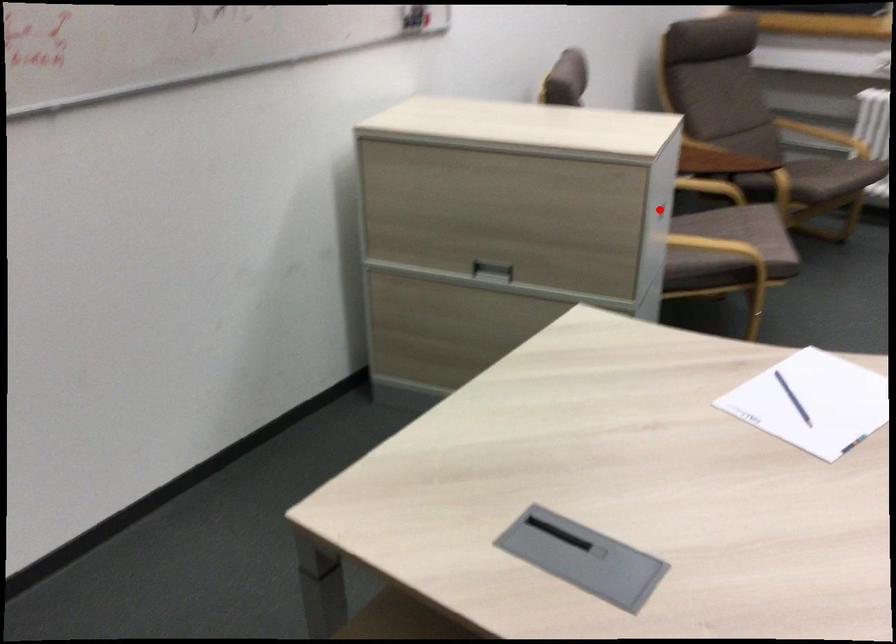
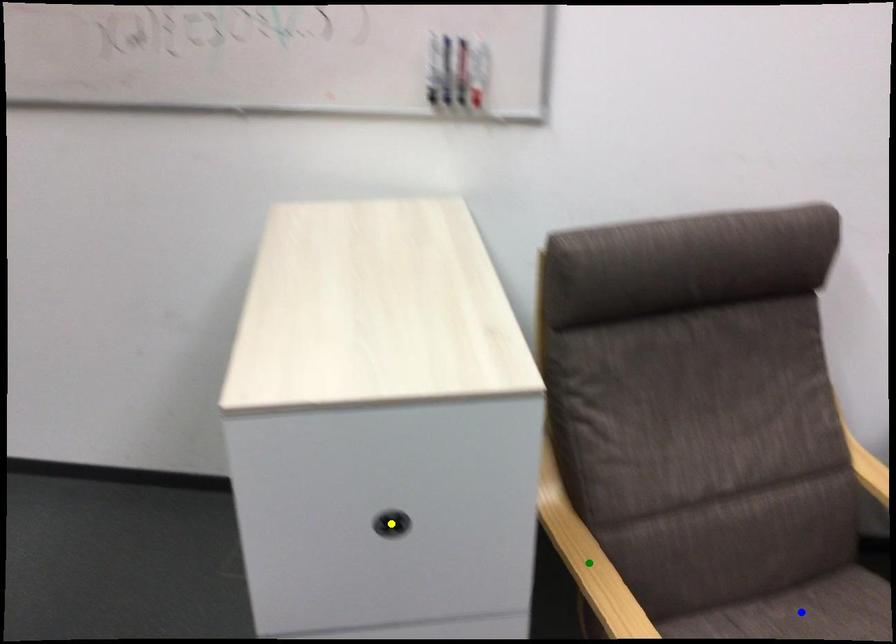
Question: I am providing you with two images of the same scene from different viewpoints. A red point is marked on the first image. You are given multiple points on the second image. Which mark in image 2 goes with the point in image 1?

Choices:
 (A) blue point
 (B) yellow point
 (C) green point

Answer: (B)